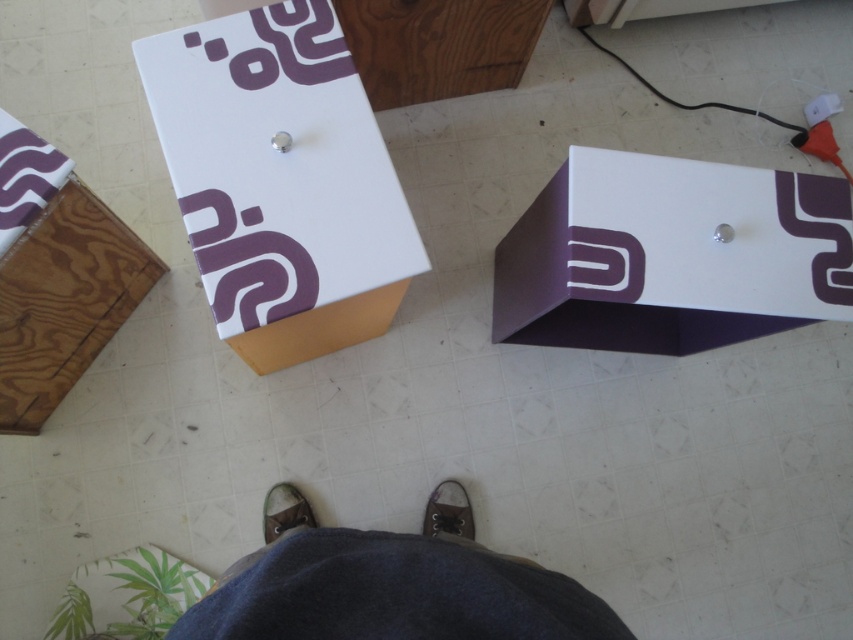
Measure the distance between dark blue jeans at center and camera.

A distance of 27.21 inches exists between dark blue jeans at center and camera.

Can you confirm if dark blue jeans at center is positioned above brown leather shoe at center?

Yes.

Between point (335, 576) and point (442, 488), which one is positioned in front?

Point (335, 576) is in front.

Where is `dark blue jeans at center`? dark blue jeans at center is located at coordinates (392, 593).

Locate an element on the screen. The height and width of the screenshot is (640, 853). matte white box at center is located at coordinates (671, 256).

Looking at this image, can you confirm if matte white box at center is wider than brown suede shoe at center?

Correct, the width of matte white box at center exceeds that of brown suede shoe at center.

Between point (547, 332) and point (310, 508), which one is positioned behind?

Positioned behind is point (547, 332).

At what (x,y) coordinates should I click in order to perform the action: click on matte white box at center. Please return your answer as a coordinate pair (x, y). The image size is (853, 640). Looking at the image, I should click on (671, 256).

Locate an element on the screen. wooden box at lower left is located at coordinates (56, 276).

Looking at this image, is wooden box at lower left above brown leather shoe at center?

Yes.

Is point (33, 426) closer to camera compared to point (426, 515)?

Yes, it is in front of point (426, 515).

Locate an element on the screen. The image size is (853, 640). wooden box at lower left is located at coordinates (56, 276).